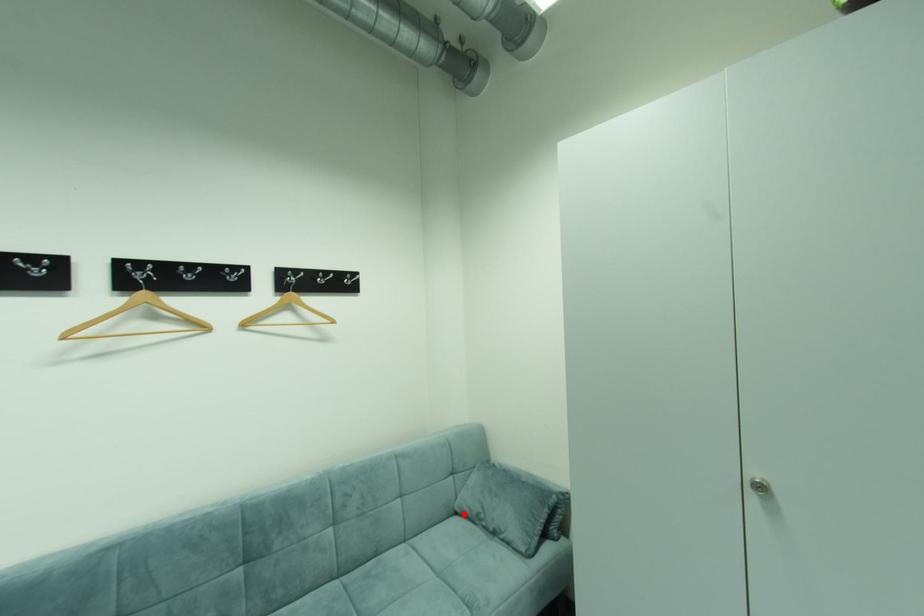
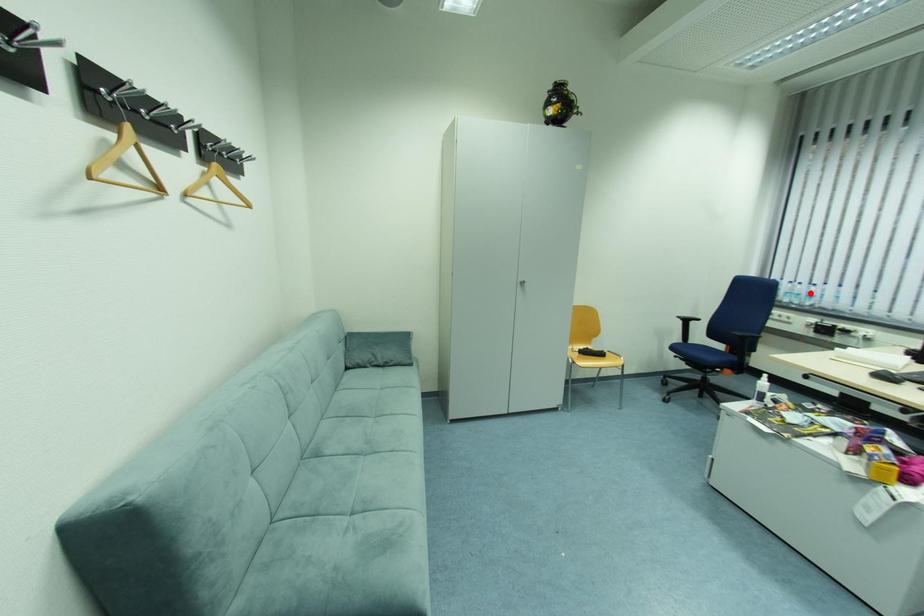
I am providing you with two images of the same scene from different viewpoints. A red point is marked on the first image and another point is marked on the second image. Are the points marked in image1 and image2 representing the same 3D position?

No